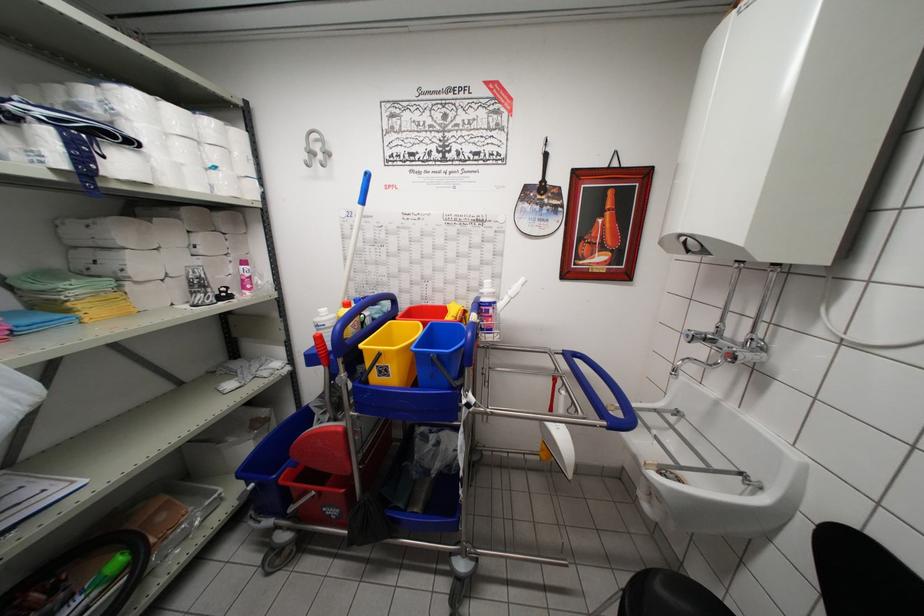
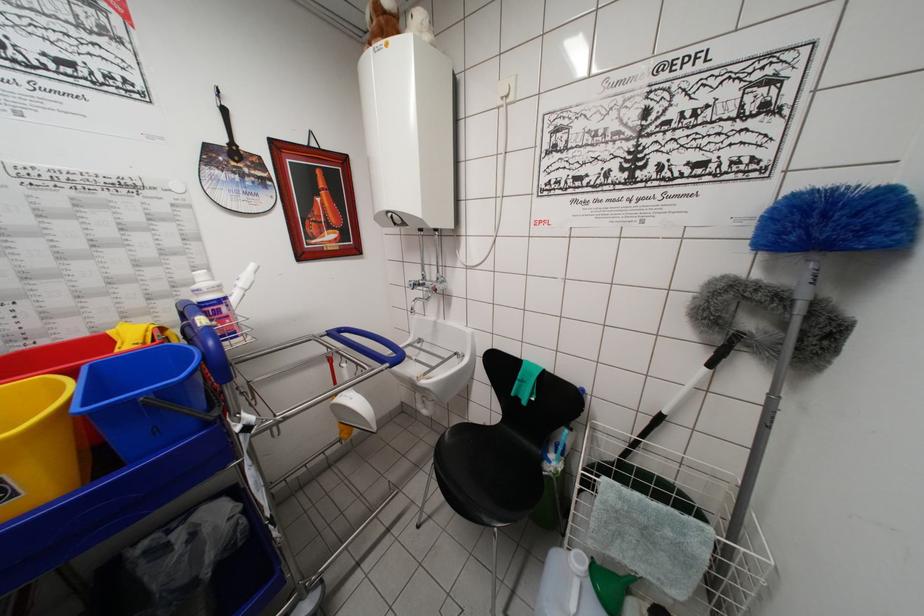
Locate, in the second image, the point that corresponds to (473,323) in the first image.

(202, 330)